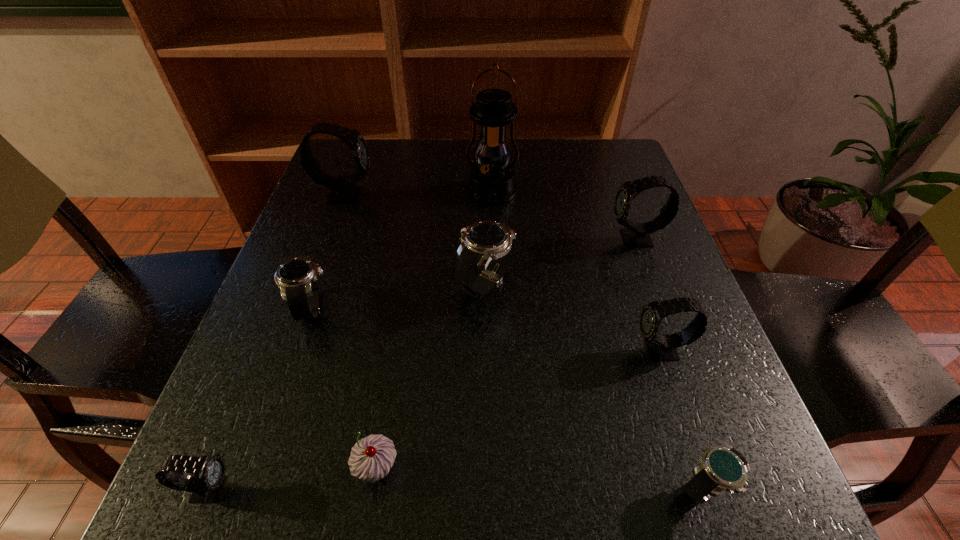
Locate an element on the screen. This screenshot has height=540, width=960. free spot located 0.250m on the face of the second tallest watch is located at coordinates (493, 239).

You are a GUI agent. You are given a task and a screenshot of the screen. Output one action in this format:
    pyautogui.click(x=<x>, y=<y>)
    Task: Click on the vacant region located 0.220m on the back of the biggest silver watch
    This screenshot has width=960, height=540.
    Given the screenshot: What is the action you would take?
    pyautogui.click(x=485, y=195)

In order to click on free space located 0.210m on the face of the second nearest gray watch in this screenshot , I will do `click(511, 350)`.

Where is `vacant space located 0.210m on the face of the second nearest gray watch`? This screenshot has height=540, width=960. vacant space located 0.210m on the face of the second nearest gray watch is located at coordinates tap(511, 350).

Find the location of a particular element. free space located 0.050m on the face of the second nearest gray watch is located at coordinates (604, 350).

Find the location of a particular element. The height and width of the screenshot is (540, 960). free point located on the back of the second smallest silver watch is located at coordinates (326, 266).

Identify the location of vacant space located on the back of the sixth object from right to left. The height and width of the screenshot is (540, 960). (406, 281).

What are the coordinates of `free spot located on the face of the smallest gray watch` in the screenshot? It's located at (433, 488).

Where is `vacant space located on the back of the shortest watch`? The image size is (960, 540). vacant space located on the back of the shortest watch is located at coordinates (665, 372).

Find the location of a particular element. The image size is (960, 540). lantern located at the far edge is located at coordinates (491, 182).